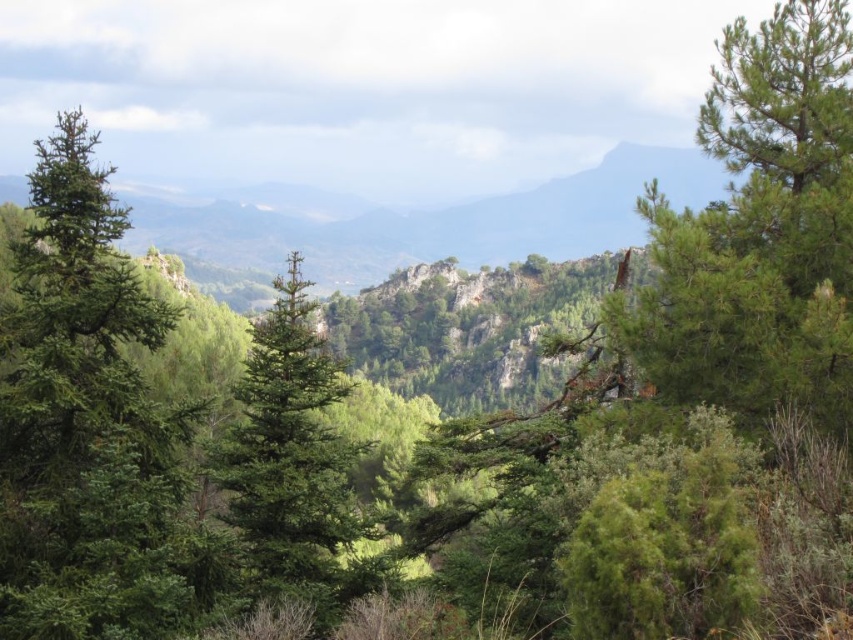
You are standing at the point with coordinates point (819, 364) and want to walk to the point with coordinates point (100, 596). According to the scene, will the path between them be obstructed by the coniferous trees in the foreground?

Point (819, 364) is behind point (100, 596), so the path between them would be obstructed by the coniferous trees in the foreground since the starting point is further back.